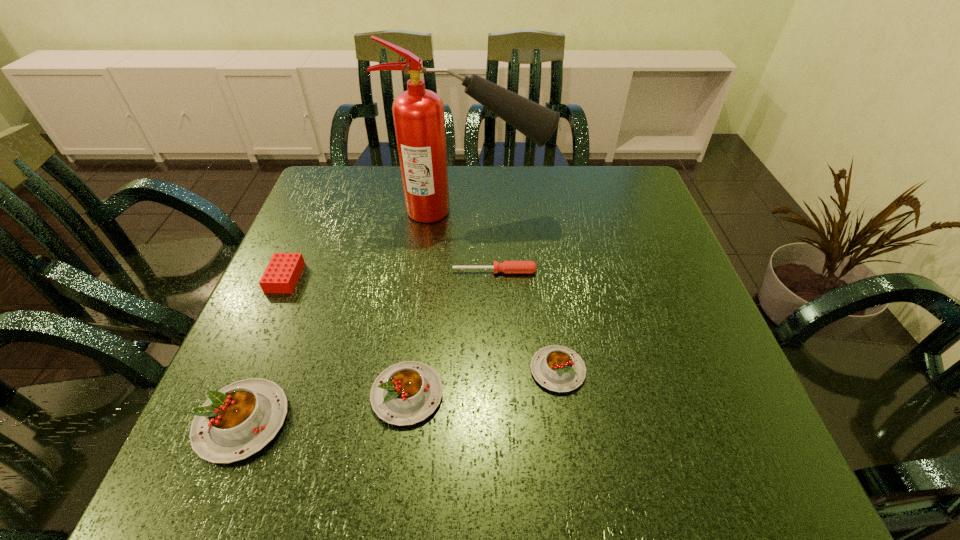
Where is `the leftmost pudding`? This screenshot has width=960, height=540. the leftmost pudding is located at coordinates (237, 421).

Locate an element on the screen. This screenshot has width=960, height=540. the tallest pudding is located at coordinates (237, 421).

This screenshot has width=960, height=540. I want to click on the second pudding from right to left, so click(405, 393).

Where is `the fourth shortest object`? the fourth shortest object is located at coordinates (405, 393).

Locate an element on the screen. This screenshot has height=540, width=960. the shortest pudding is located at coordinates (557, 368).

Identify the location of the farthest object. (419, 121).

I want to click on the tallest object, so click(419, 121).

The image size is (960, 540). In order to click on Lego in this screenshot , I will do point(283,271).

Identify the location of the shortest object. Image resolution: width=960 pixels, height=540 pixels. (508, 267).

The width and height of the screenshot is (960, 540). I want to click on blank area located 0.180m on the back of the leftmost pudding, so (x=289, y=306).